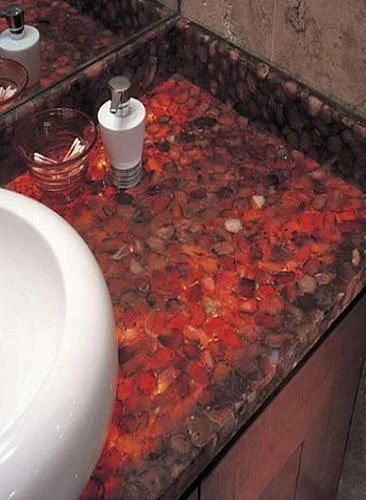
Find the location of a particular element. This screenshot has height=500, width=366. qtip is located at coordinates (73, 141), (76, 144), (79, 149), (80, 152), (36, 160), (38, 155).